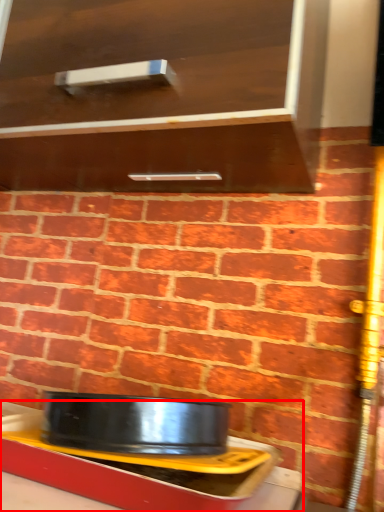
Question: From the image's perspective, where is table (annotated by the red box) located relative to cabinetry?

Choices:
 (A) above
 (B) below

Answer: (B)